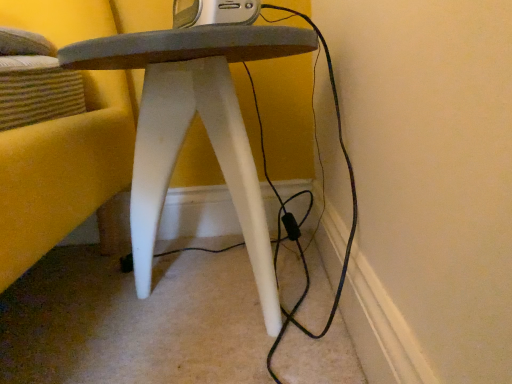
Describe the element at coordinates (214, 12) in the screenshot. I see `silver metallic radio at upper center` at that location.

Find the location of `silver metallic radio at upper center`. silver metallic radio at upper center is located at coordinates (214, 12).

Where is `white matte stool at center`? Image resolution: width=512 pixels, height=384 pixels. white matte stool at center is located at coordinates (189, 124).

Describe the element at coordinates (189, 124) in the screenshot. This screenshot has width=512, height=384. I see `white matte stool at center` at that location.

This screenshot has height=384, width=512. What are the coordinates of `silver metallic radio at upper center` in the screenshot? It's located at pyautogui.click(x=214, y=12).

Which is more to the right, silver metallic radio at upper center or white matte stool at center?

silver metallic radio at upper center.

Is silver metallic radio at upper center positioned behind white matte stool at center?

Yes.

Does point (249, 13) appear closer or farther from the camera than point (135, 273)?

Point (249, 13) appears to be closer to the viewer than point (135, 273).

From the image's perspective, is silver metallic radio at upper center above white matte stool at center?

Indeed, from the image's perspective, silver metallic radio at upper center is shown above white matte stool at center.

From a real-world perspective, does silver metallic radio at upper center stand above white matte stool at center?

Indeed, from a real-world perspective, silver metallic radio at upper center stands above white matte stool at center.

Which of these two, silver metallic radio at upper center or white matte stool at center, is thinner?

silver metallic radio at upper center is thinner.

Who is shorter, silver metallic radio at upper center or white matte stool at center?

Standing shorter between the two is silver metallic radio at upper center.

Between silver metallic radio at upper center and white matte stool at center, which one has smaller size?

silver metallic radio at upper center.

Can white matte stool at center be found inside silver metallic radio at upper center?

No, white matte stool at center is not inside silver metallic radio at upper center.

Is the surface of silver metallic radio at upper center in direct contact with white matte stool at center?

No, silver metallic radio at upper center is not touching white matte stool at center.

Is silver metallic radio at upper center facing away from white matte stool at center?

silver metallic radio at upper center is not turned away from white matte stool at center.

How different are the orientations of silver metallic radio at upper center and white matte stool at center in degrees?

silver metallic radio at upper center and white matte stool at center are facing 60.8 degrees away from each other.

How far apart are silver metallic radio at upper center and white matte stool at center?

The distance of silver metallic radio at upper center from white matte stool at center is 6.67 inches.

At what (x,y) coordinates should I click in order to perform the action: click on gadget that is behind the white matte stool at center. Please return your answer as a coordinate pair (x, y). The width and height of the screenshot is (512, 384). Looking at the image, I should click on (214, 12).

Which object is positioned more to the left, white matte stool at center or silver metallic radio at upper center?

From the viewer's perspective, white matte stool at center appears more on the left side.

Who is more distant, white matte stool at center or silver metallic radio at upper center?

silver metallic radio at upper center is further from the camera.

Is point (133, 214) positioned behind point (179, 3)?

Yes.

From the image's perspective, between white matte stool at center and silver metallic radio at upper center, which one is located above?

silver metallic radio at upper center, from the image's perspective.

Based on the photo, from a real-world perspective, is white matte stool at center positioned above or below silver metallic radio at upper center?

white matte stool at center is situated lower than silver metallic radio at upper center in the real world.

Does white matte stool at center have a lesser width compared to silver metallic radio at upper center?

No, white matte stool at center is not thinner than silver metallic radio at upper center.

Between white matte stool at center and silver metallic radio at upper center, which one has less height?

silver metallic radio at upper center is shorter.

Based on the photo, in terms of size, does white matte stool at center appear bigger or smaller than silver metallic radio at upper center?

Considering their sizes, white matte stool at center takes up more space than silver metallic radio at upper center.

Can we say white matte stool at center lies outside silver metallic radio at upper center?

white matte stool at center lies outside silver metallic radio at upper center's area.

Would you consider white matte stool at center to be distant from silver metallic radio at upper center?

No, white matte stool at center is in close proximity to silver metallic radio at upper center.

Could you tell me if white matte stool at center is facing silver metallic radio at upper center?

No, white matte stool at center is not oriented towards silver metallic radio at upper center.

How different are the orientations of white matte stool at center and silver metallic radio at upper center in degrees?

white matte stool at center and silver metallic radio at upper center are facing 60.8 degrees away from each other.

The image size is (512, 384). What are the coordinates of `stool in front of the silver metallic radio at upper center` in the screenshot? It's located at click(189, 124).

At what (x,y) coordinates should I click in order to perform the action: click on gadget above the white matte stool at center (from a real-world perspective). Please return your answer as a coordinate pair (x, y). Looking at the image, I should click on (214, 12).

Identify the location of stool below the silver metallic radio at upper center (from a real-world perspective). The height and width of the screenshot is (384, 512). (189, 124).